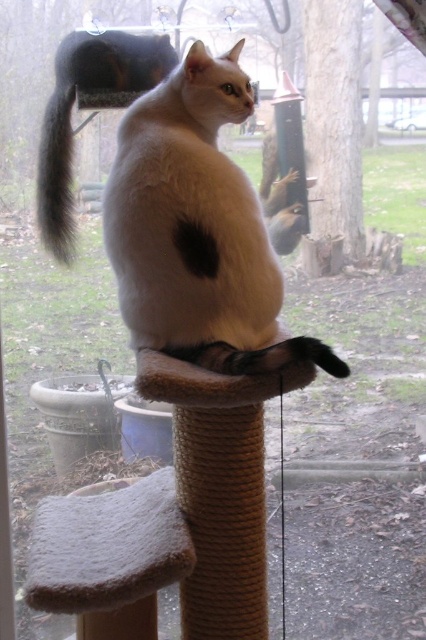
Based on the photo, you are taking a photo of the cat tree and notice two points on the cat tree. One is at point (51, 173) and the other is at point (69, 157). Which point is closer to you when you are holding the camera?

Point (51, 173) is closer to the camera than point (69, 157).

From the picture: You are standing in the room where the white cat with a black patch on its back is perched on the cat tree. You want to pet the cat but must stay at least 3 feet away from the point marked at coordinate point (207,269) to avoid startling it. Can you safely approach the cat while maintaining this distance?

The distance between you and the point marked at coordinate point (207,269) is 4.23 feet, which is greater than the required 3 feet. Therefore, you can safely approach the cat while maintaining the required distance.

You are standing in the room where the white cat is perched on the cat tree. You want to place a small toy between the point at (132, 54) and the point at (347, 374). Which point is closer to you so you can place the toy nearer to it?

Point (132, 54) is closer to you than point (347, 374) because it is further to the camera, meaning it is physically nearer to your position in the room.